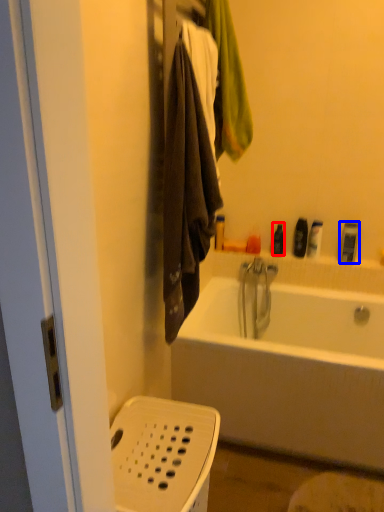
Question: Which point is further to the camera, toiletry (highlighted by a red box) or toiletry (highlighted by a blue box)?

Choices:
 (A) toiletry
 (B) toiletry

Answer: (A)